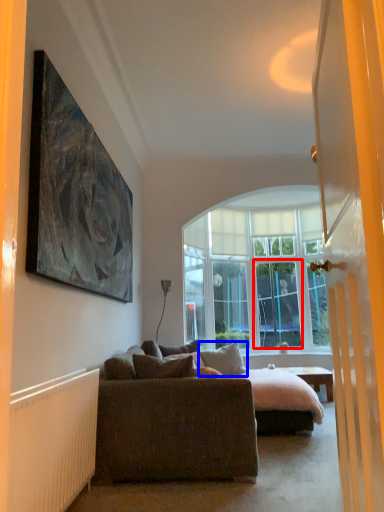
Question: Which object is further to the camera taking this photo, screen door (highlighted by a red box) or pillow (highlighted by a blue box)?

Choices:
 (A) screen door
 (B) pillow

Answer: (A)